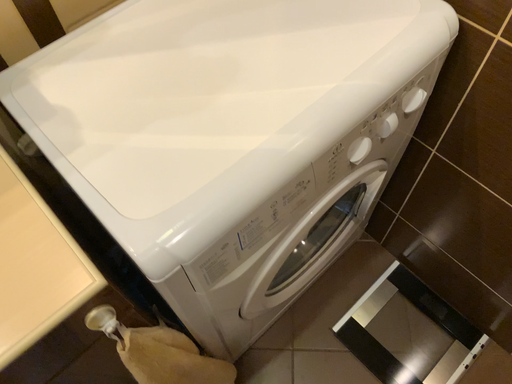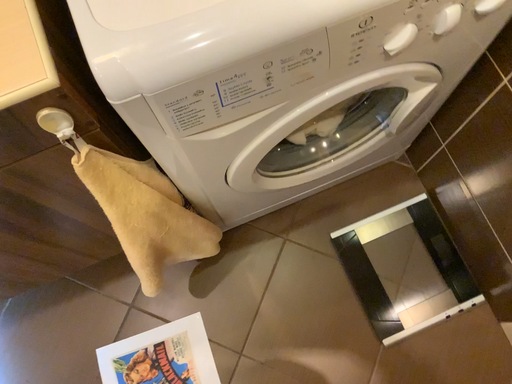
Question: Which way did the camera rotate in the video?

Choices:
 (A) rotated upward
 (B) rotated downward

Answer: (B)